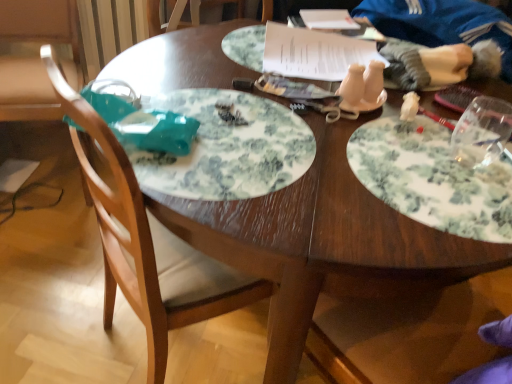
You are a GUI agent. You are given a task and a screenshot of the screen. Output one action in this format:
    pyautogui.click(x=<x>, y=<y>)
    Task: Click on the free location above white floral plate at center, placed as the first plate when sorted from left to right (from a real-world perspective)
    
    Given the screenshot: What is the action you would take?
    pyautogui.click(x=231, y=133)